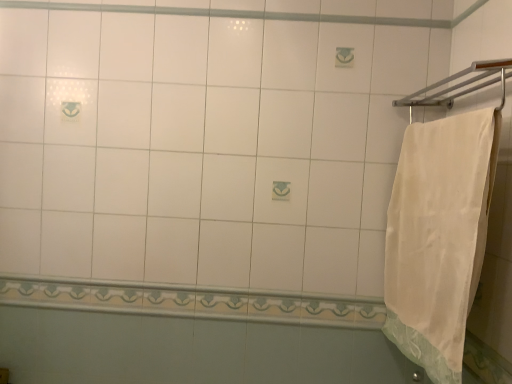
Measure the distance between point (318,324) and camera.

A distance of 1.62 meters exists between point (318,324) and camera.

In order to face white glossy tile at lower center, should I rotate leftwards or rightwards?

Rotate your view left by about 8.581°.

At what (x,y) coordinates should I click in order to perform the action: click on white cotton towel at right. Please return your answer as a coordinate pair (x, y). The width and height of the screenshot is (512, 384). Looking at the image, I should click on (439, 237).

The width and height of the screenshot is (512, 384). Find the location of `white glossy tile at lower center`. white glossy tile at lower center is located at coordinates (194, 302).

Between silver metallic towel bar at upper right and white cotton towel at right, which one has larger size?

With larger size is white cotton towel at right.

Which object is closer to the camera, silver metallic towel bar at upper right or white cotton towel at right?

Positioned in front is silver metallic towel bar at upper right.

Between silver metallic towel bar at upper right and white cotton towel at right, which one appears on the right side from the viewer's perspective?

silver metallic towel bar at upper right.

Considering the sizes of objects white cotton towel at right and white glossy tile at lower center in the image provided, who is wider, white cotton towel at right or white glossy tile at lower center?

white cotton towel at right.

Would you say white cotton towel at right is inside or outside white glossy tile at lower center?

white cotton towel at right is outside white glossy tile at lower center.

Is point (393, 234) positioned behind point (262, 312)?

No, it is not.

Is the position of white cotton towel at right more distant than that of white glossy tile at lower center?

No, it is not.

Between white cotton towel at right and silver metallic towel bar at upper right, which one is positioned in front?

Positioned in front is silver metallic towel bar at upper right.

What's the angular difference between white cotton towel at right and silver metallic towel bar at upper right's facing directions?

2.29e-05 degrees separate the facing orientations of white cotton towel at right and silver metallic towel bar at upper right.

Is white cotton towel at right not close to silver metallic towel bar at upper right?

They are positioned close to each other.

Considering the relative sizes of white cotton towel at right and silver metallic towel bar at upper right in the image provided, is white cotton towel at right bigger than silver metallic towel bar at upper right?

Indeed, white cotton towel at right has a larger size compared to silver metallic towel bar at upper right.

Is point (508, 63) more distant than point (330, 322)?

No, (508, 63) is in front of (330, 322).

In the image, is silver metallic towel bar at upper right positioned in front of or behind white glossy tile at lower center?

silver metallic towel bar at upper right is positioned closer to the viewer than white glossy tile at lower center.

Between silver metallic towel bar at upper right and white glossy tile at lower center, which one has less height?

Standing shorter between the two is white glossy tile at lower center.

Does white glossy tile at lower center touch white cotton towel at right?

No, white glossy tile at lower center is not in contact with white cotton towel at right.

From a real-world perspective, does white glossy tile at lower center stand above white cotton towel at right?

No, from a real-world perspective, white glossy tile at lower center is not on top of white cotton towel at right.

Which point is more forward, (7,289) or (442,186)?

The point (442,186) is closer.

What's the angular difference between white glossy tile at lower center and white cotton towel at right's facing directions?

There is a 90-degree angle between the facing directions of white glossy tile at lower center and white cotton towel at right.

Measure the distance between white glossy tile at lower center and silver metallic towel bar at upper right.

white glossy tile at lower center and silver metallic towel bar at upper right are 37.69 inches apart from each other.

Is white glossy tile at lower center placed right next to silver metallic towel bar at upper right?

white glossy tile at lower center and silver metallic towel bar at upper right are clearly separated.

Between white glossy tile at lower center and silver metallic towel bar at upper right, which one appears on the left side from the viewer's perspective?

From the viewer's perspective, white glossy tile at lower center appears more on the left side.

How different are the orientations of white glossy tile at lower center and silver metallic towel bar at upper right in degrees?

The facing directions of white glossy tile at lower center and silver metallic towel bar at upper right are 90 degrees apart.

Where is `towel behind the silver metallic towel bar at upper right`? towel behind the silver metallic towel bar at upper right is located at coordinates (439, 237).

Find the location of a particular element. The width and height of the screenshot is (512, 384). towel located on the right of white glossy tile at lower center is located at coordinates (439, 237).

From the image, which object appears to be farther from white glossy tile at lower center, silver metallic towel bar at upper right or white cotton towel at right?

Based on the image, silver metallic towel bar at upper right appears to be further to white glossy tile at lower center.

Estimate the real-world distances between objects in this image. Which object is closer to white glossy tile at lower center, white cotton towel at right or silver metallic towel bar at upper right?

white cotton towel at right lies closer to white glossy tile at lower center than the other object.

From the image, which object appears to be farther from silver metallic towel bar at upper right, white glossy tile at lower center or white cotton towel at right?

Among the two, white glossy tile at lower center is located further to silver metallic towel bar at upper right.

Estimate the real-world distances between objects in this image. Which object is further from silver metallic towel bar at upper right, white cotton towel at right or white glossy tile at lower center?

Among the two, white glossy tile at lower center is located further to silver metallic towel bar at upper right.

Estimate the real-world distances between objects in this image. Which object is closer to white cotton towel at right, white glossy tile at lower center or silver metallic towel bar at upper right?

silver metallic towel bar at upper right.

When comparing their distances from white cotton towel at right, does silver metallic towel bar at upper right or white glossy tile at lower center seem closer?

silver metallic towel bar at upper right.

Identify the location of towel located between white glossy tile at lower center and silver metallic towel bar at upper right in the left-right direction. (439, 237).